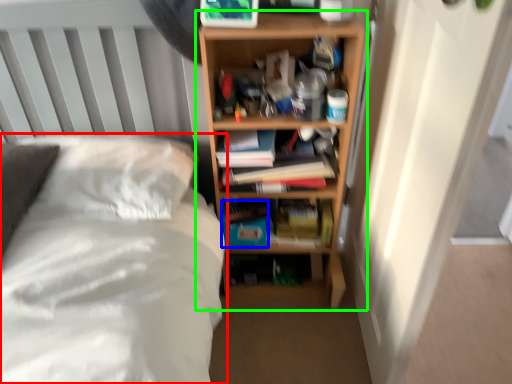
Question: Which object is the farthest from bed (highlighted by a red box)? Choose among these: paperback book (highlighted by a blue box) or shelf (highlighted by a green box).

Choices:
 (A) paperback book
 (B) shelf

Answer: (B)